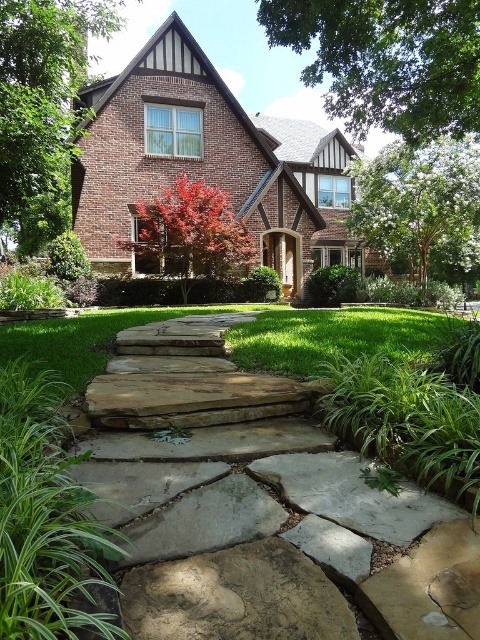
Who is lower down, natural stone pathway at center or shiny red maple tree at center?

Positioned lower is natural stone pathway at center.

Does natural stone pathway at center come behind shiny red maple tree at center?

No, it is in front of shiny red maple tree at center.

Identify the location of natural stone pathway at center. This screenshot has height=640, width=480. (261, 515).

You are a GUI agent. You are given a task and a screenshot of the screen. Output one action in this format:
    pyautogui.click(x=<x>, y=<y>)
    Task: Click on the brown rough stone at center
    
    Given the screenshot: What is the action you would take?
    pyautogui.click(x=236, y=596)

Is brown rough stone at center positioned before green grass at center?

That is True.

Between point (236, 592) and point (300, 337), which one is positioned in front?

Point (236, 592) is in front.

Identify the location of brown rough stone at center. (236, 596).

Does natural stone pathway at center have a lesser width compared to white textured tree at upper right?

No, natural stone pathway at center is not thinner than white textured tree at upper right.

Is point (392, 604) positioned after point (437, 205)?

That is False.

At what (x,y) coordinates should I click in order to perform the action: click on natural stone pathway at center. Please return your answer as a coordinate pair (x, y). The image size is (480, 640). Looking at the image, I should click on click(261, 515).